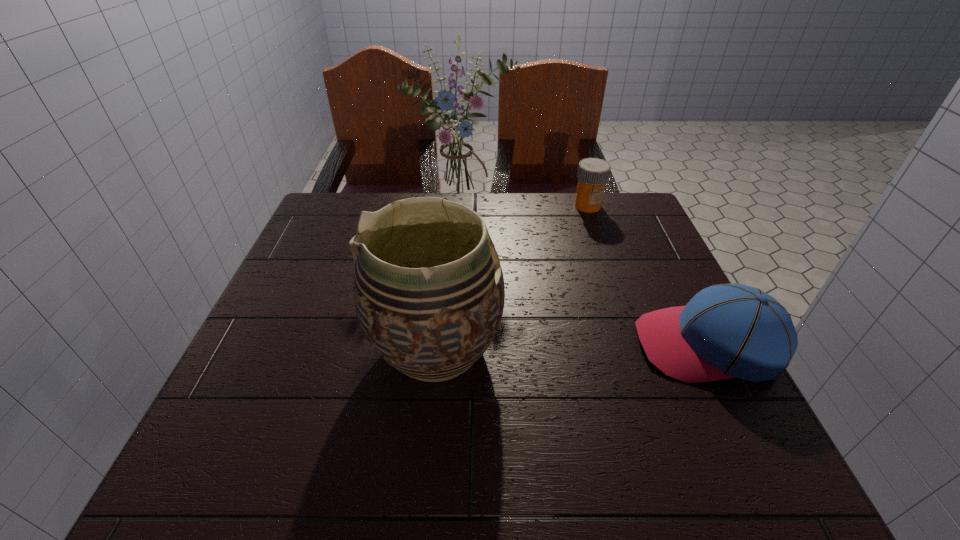
Find the location of a particular element. vacant space on the desktop that is between the third shortest object and the baseball cap and is positioned on the front-facing side of the bouquet is located at coordinates (573, 347).

The image size is (960, 540). In order to click on free space on the desktop that is between the pottery and the baseball cap and is positioned on the label side of the medicine in this screenshot , I will do `click(609, 346)`.